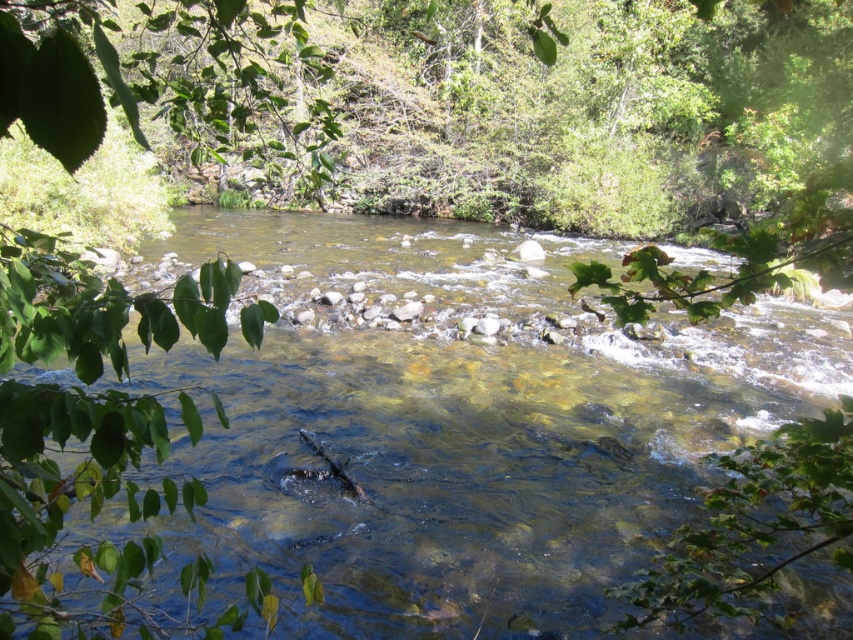
How distant is clear water at center from green leafy branch at left?

The distance of clear water at center from green leafy branch at left is 8.18 meters.

What do you see at coordinates (415, 460) in the screenshot?
I see `clear water at center` at bounding box center [415, 460].

Identify the location of clear water at center. (415, 460).